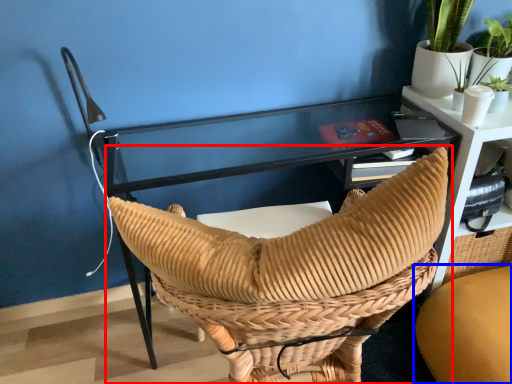
Question: Which point is closer to the camera, chair (highlighted by a red box) or chair (highlighted by a blue box)?

Choices:
 (A) chair
 (B) chair

Answer: (A)